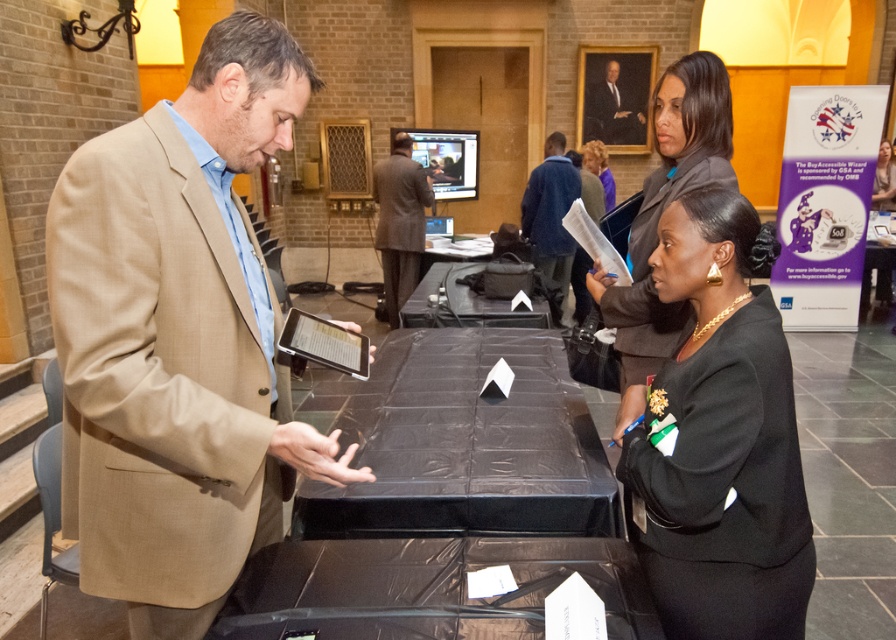
Question: Among these objects, which one is farthest from the camera?

Choices:
 (A) gray suit at center
 (B) oil painting portrait at upper center
 (C) purple fabric shirt at center

Answer: (B)

Question: Is gray suit at center to the right of oil painting portrait at upper center from the viewer's perspective?

Choices:
 (A) yes
 (B) no

Answer: (B)

Question: Considering the relative positions of black fabric jacket at upper right and oil painting portrait at upper center in the image provided, where is black fabric jacket at upper right located with respect to oil painting portrait at upper center?

Choices:
 (A) right
 (B) left

Answer: (B)

Question: Which of these objects is positioned farthest from the black fabric jacket at upper right?

Choices:
 (A) oil painting portrait at upper center
 (B) purple fabric shirt at center
 (C) blue woolen sweater at center
 (D) black satin blazer at center

Answer: (A)

Question: Which of the following is the closest to the observer?

Choices:
 (A) (613, 192)
 (B) (403, 273)
 (C) (612, 65)

Answer: (B)

Question: Is black fabric jacket at upper right thinner than blue woolen sweater at center?

Choices:
 (A) no
 (B) yes

Answer: (B)